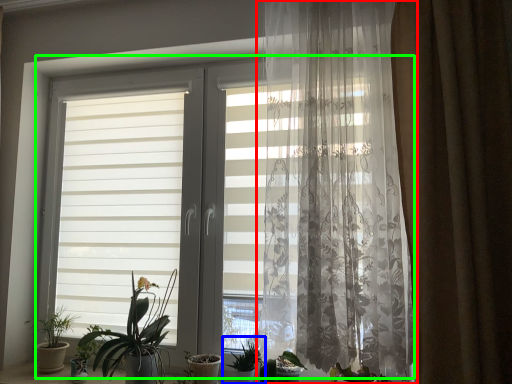
Question: Estimate the real-world distances between objects in this image. Which object is farther from curtain (highlighted by a red box), houseplant (highlighted by a blue box) or window (highlighted by a green box)?

Choices:
 (A) houseplant
 (B) window

Answer: (A)